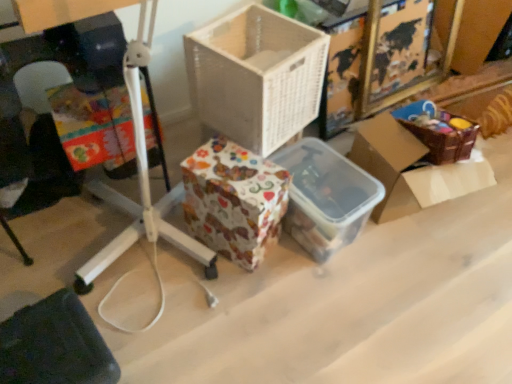
Question: Is the depth of brown woven basket at upper right, positioned as the first box in right-to-left order, greater than that of translucent plastic container at center, which is the 2th storage box from left to right?

Choices:
 (A) no
 (B) yes

Answer: (B)

Question: Can you confirm if brown woven basket at upper right, the 2th box positioned from the left, is thinner than translucent plastic container at center, which is the 2th storage box from left to right?

Choices:
 (A) no
 (B) yes

Answer: (A)

Question: Considering the relative sizes of brown woven basket at upper right, the 2th box positioned from the left, and translucent plastic container at center, the first storage box in the right-to-left sequence, in the image provided, is brown woven basket at upper right, the 2th box positioned from the left, smaller than translucent plastic container at center, the first storage box in the right-to-left sequence,?

Choices:
 (A) no
 (B) yes

Answer: (A)

Question: Is brown woven basket at upper right, positioned as the first box in right-to-left order, far away from translucent plastic container at center, the first storage box in the right-to-left sequence?

Choices:
 (A) yes
 (B) no

Answer: (B)

Question: Does brown woven basket at upper right, the 2th box positioned from the left, lie in front of translucent plastic container at center, the first storage box in the right-to-left sequence?

Choices:
 (A) yes
 (B) no

Answer: (B)

Question: Is point (219, 210) closer or farther from the camera than point (84, 352)?

Choices:
 (A) closer
 (B) farther

Answer: (B)

Question: From a real-world perspective, relative to dark fabric at lower left, is patterned paper storage box at center, positioned as the 2th storage box in right-to-left order, vertically above or below?

Choices:
 (A) below
 (B) above

Answer: (B)

Question: Is patterned paper storage box at center, positioned as the 2th storage box in right-to-left order, bigger or smaller than dark fabric at lower left?

Choices:
 (A) small
 (B) big

Answer: (B)

Question: Looking at their shapes, would you say patterned paper storage box at center, which ranks as the 1th storage box in left-to-right order, is wider or thinner than dark fabric at lower left?

Choices:
 (A) wide
 (B) thin

Answer: (B)

Question: From a real-world perspective, relative to patterned paper storage box at center, positioned as the 2th storage box in right-to-left order, is brown woven basket at upper right, the 2th box positioned from the left, vertically above or below?

Choices:
 (A) above
 (B) below

Answer: (B)

Question: Choose the correct answer: Is brown woven basket at upper right, positioned as the first box in right-to-left order, inside patterned paper storage box at center, positioned as the 2th storage box in right-to-left order, or outside it?

Choices:
 (A) outside
 (B) inside

Answer: (A)

Question: Considering the positions of brown woven basket at upper right, positioned as the first box in right-to-left order, and patterned paper storage box at center, which ranks as the 1th storage box in left-to-right order, in the image, is brown woven basket at upper right, positioned as the first box in right-to-left order, wider or thinner than patterned paper storage box at center, which ranks as the 1th storage box in left-to-right order,?

Choices:
 (A) wide
 (B) thin

Answer: (A)

Question: Is point (446, 193) positioned closer to the camera than point (205, 210)?

Choices:
 (A) farther
 (B) closer

Answer: (A)

Question: Would you say white wicker basket at center, the second box in the right-to-left sequence, is to the left or to the right of brown woven basket at upper right, the 2th box positioned from the left, in the picture?

Choices:
 (A) left
 (B) right

Answer: (A)

Question: From a real-world perspective, is white wicker basket at center, the 1th box when ordered from left to right, above or below brown woven basket at upper right, positioned as the first box in right-to-left order?

Choices:
 (A) below
 (B) above

Answer: (B)